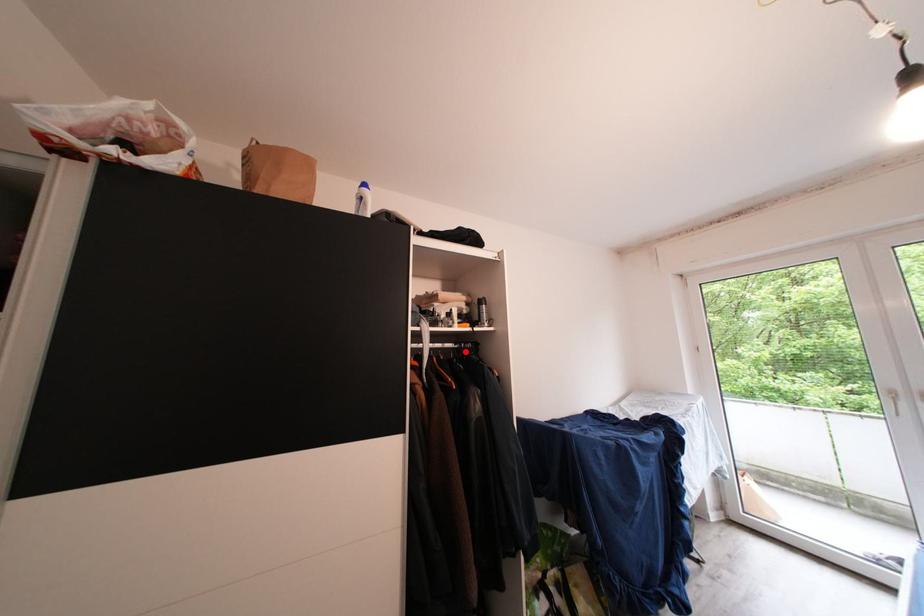
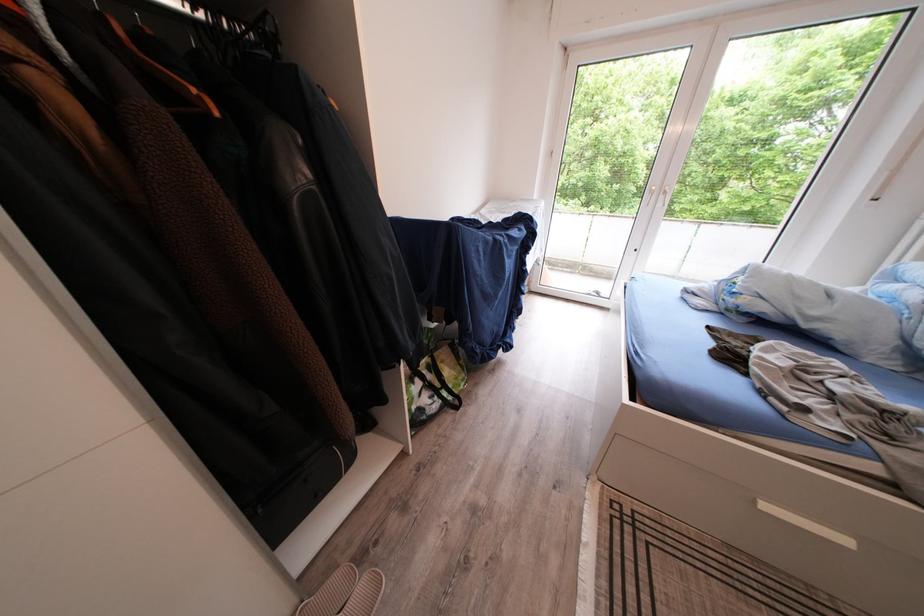
In the second image, find the point that corresponds to the highlighted location in the first image.

(210, 21)